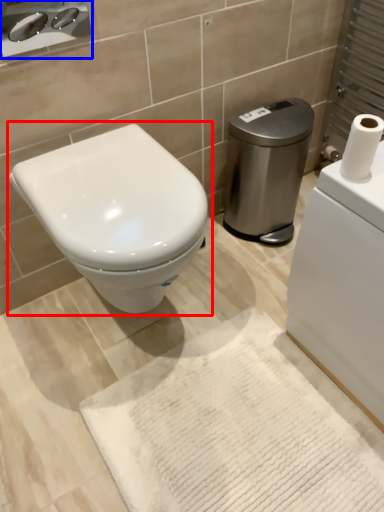
Question: Which object is closer to the camera taking this photo, toilet (highlighted by a red box) or sink (highlighted by a blue box)?

Choices:
 (A) toilet
 (B) sink

Answer: (A)